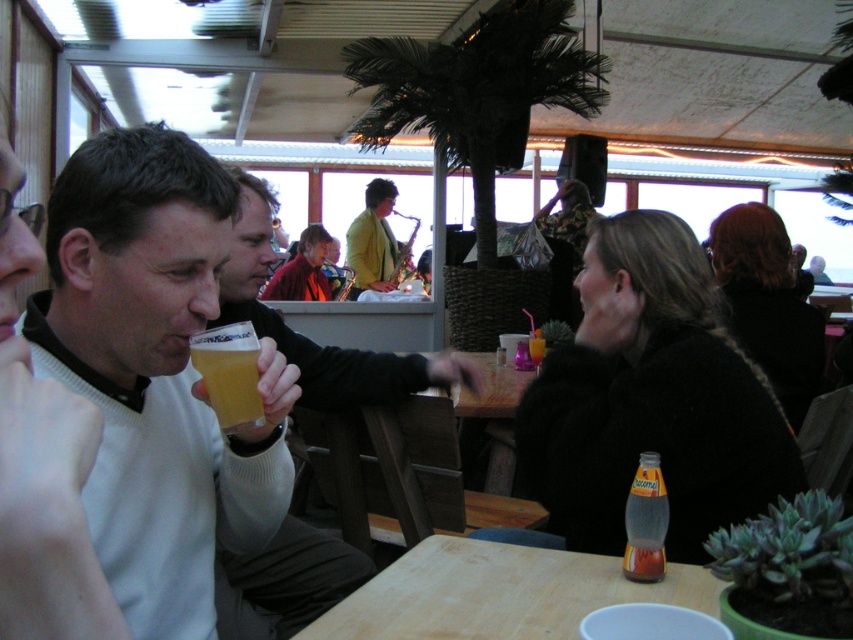
You are standing in the scene and want to place a small table between you and the point at coordinates point (x=352, y=356). The table requires 2 meters of space. Is there enough space to place it?

The distance between you and point (x=352, y=356) is 1.97 meters, which is slightly less than the required 2 meters. Therefore, there is not enough space to place the table.

You are a barista trying to place two mugs on a counter. The matte white sweater at center and the matte red sweater at center are on the counter. If the counter has only enough space for one of them, which one should you choose based on their widths?

The matte white sweater at center might be wider than the matte red sweater at center, so you should choose the matte red sweater at center to fit on the counter.